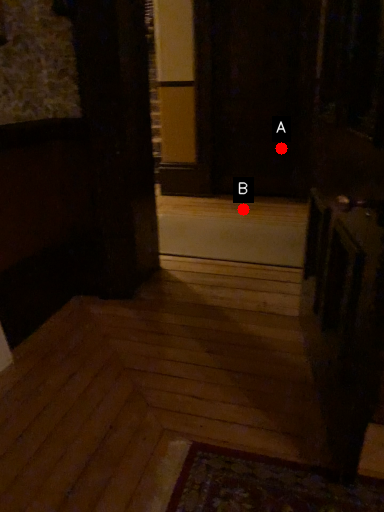
Question: Two points are circled on the image, labeled by A and B beside each circle. Among these points, which one is nearest to the camera?

Choices:
 (A) A is closer
 (B) B is closer

Answer: (B)